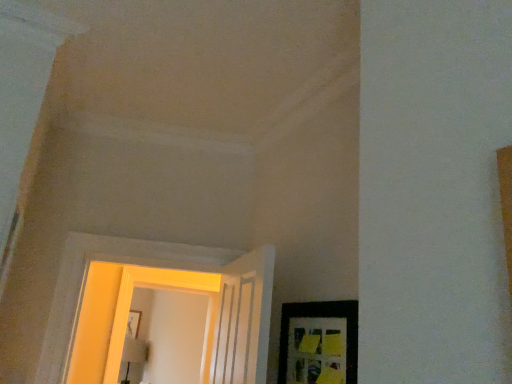
What is the approximate height of yellow painted wood door at center?

yellow painted wood door at center is 1.01 meters tall.

Find the location of a particular element. This screenshot has width=512, height=384. yellow painted wood door at center is located at coordinates (163, 289).

Image resolution: width=512 pixels, height=384 pixels. What do you see at coordinates (163, 289) in the screenshot? I see `yellow painted wood door at center` at bounding box center [163, 289].

What is the approximate width of matte black picture frame at lower right?

matte black picture frame at lower right is 1.12 inches wide.

What do you see at coordinates (319, 343) in the screenshot?
I see `matte black picture frame at lower right` at bounding box center [319, 343].

Locate an element on the screen. This screenshot has width=512, height=384. matte black picture frame at lower right is located at coordinates (319, 343).

At what (x,y) coordinates should I click in order to perform the action: click on yellow painted wood door at center. Please return your answer as a coordinate pair (x, y). Looking at the image, I should click on (163, 289).

Considering the relative positions of yellow painted wood door at center and matte black picture frame at lower right in the image provided, is yellow painted wood door at center to the left or to the right of matte black picture frame at lower right?

Based on their positions, yellow painted wood door at center is located to the left of matte black picture frame at lower right.

Is the position of yellow painted wood door at center less distant than that of matte black picture frame at lower right?

No, the depth of yellow painted wood door at center is greater than that of matte black picture frame at lower right.

Is point (219, 274) closer or farther from the camera than point (309, 373)?

Point (219, 274).

Consider the image. From the image's perspective, which is above, yellow painted wood door at center or matte black picture frame at lower right?

matte black picture frame at lower right.

From a real-world perspective, is yellow painted wood door at center located higher than matte black picture frame at lower right?

Indeed, from a real-world perspective, yellow painted wood door at center stands above matte black picture frame at lower right.

In terms of width, does yellow painted wood door at center look wider or thinner when compared to matte black picture frame at lower right?

In the image, yellow painted wood door at center appears to be wider than matte black picture frame at lower right.

Does yellow painted wood door at center have a lesser height compared to matte black picture frame at lower right?

Incorrect, the height of yellow painted wood door at center does not fall short of that of matte black picture frame at lower right.

Does yellow painted wood door at center have a smaller size compared to matte black picture frame at lower right?

Actually, yellow painted wood door at center might be larger than matte black picture frame at lower right.

Is yellow painted wood door at center positioned beyond the bounds of matte black picture frame at lower right?

yellow painted wood door at center is positioned outside matte black picture frame at lower right.

Is yellow painted wood door at center beside matte black picture frame at lower right?

No, yellow painted wood door at center is not touching matte black picture frame at lower right.

Is yellow painted wood door at center positioned with its back to matte black picture frame at lower right?

yellow painted wood door at center is not turned away from matte black picture frame at lower right.

How different are the orientations of yellow painted wood door at center and matte black picture frame at lower right in degrees?

yellow painted wood door at center and matte black picture frame at lower right are facing 91.9 degrees away from each other.

The height and width of the screenshot is (384, 512). What are the coordinates of `picture frame that appears above the yellow painted wood door at center (from the image's perspective)` in the screenshot? It's located at (319, 343).

Would you say matte black picture frame at lower right is to the left or to the right of yellow painted wood door at center in the picture?

From the image, it's evident that matte black picture frame at lower right is to the right of yellow painted wood door at center.

Considering their positions, is matte black picture frame at lower right located in front of or behind yellow painted wood door at center?

matte black picture frame at lower right is positioned closer to the viewer than yellow painted wood door at center.

Looking at this image, which is more distant, (348,352) or (123,294)?

The point (123,294) is more distant.

From the image's perspective, is matte black picture frame at lower right on top of yellow painted wood door at center?

Yes, from the image's perspective, matte black picture frame at lower right is over yellow painted wood door at center.

From a real-world perspective, who is located lower, matte black picture frame at lower right or yellow painted wood door at center?

matte black picture frame at lower right.

Is matte black picture frame at lower right wider than yellow painted wood door at center?

In fact, matte black picture frame at lower right might be narrower than yellow painted wood door at center.

Considering the sizes of objects matte black picture frame at lower right and yellow painted wood door at center in the image provided, who is shorter, matte black picture frame at lower right or yellow painted wood door at center?

With less height is matte black picture frame at lower right.

Consider the image. Which of these two, matte black picture frame at lower right or yellow painted wood door at center, is smaller?

Smaller between the two is matte black picture frame at lower right.

Is matte black picture frame at lower right not within yellow painted wood door at center?

Yes.

From the picture: Can you see matte black picture frame at lower right touching yellow painted wood door at center?

No, matte black picture frame at lower right is not touching yellow painted wood door at center.

Is matte black picture frame at lower right oriented towards yellow painted wood door at center?

No.

Where is `window above the matte black picture frame at lower right (from a real-world perspective)`? This screenshot has width=512, height=384. window above the matte black picture frame at lower right (from a real-world perspective) is located at coordinates (163, 289).

This screenshot has height=384, width=512. In order to click on picture frame located above the yellow painted wood door at center (from the image's perspective) in this screenshot , I will do `click(319, 343)`.

At what (x,y) coordinates should I click in order to perform the action: click on window behind the matte black picture frame at lower right. Please return your answer as a coordinate pair (x, y). Looking at the image, I should click on (163, 289).